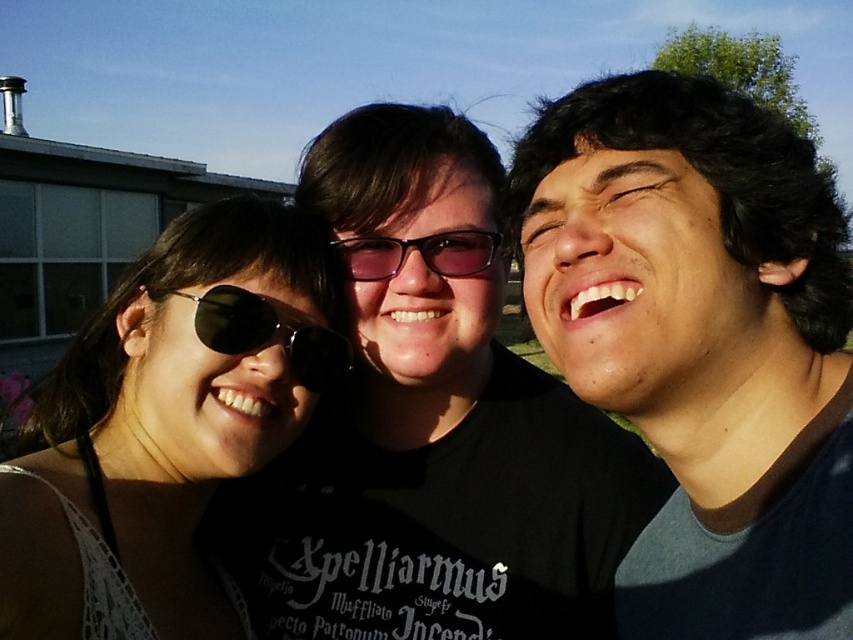
Is black reflective sunglasses at center closer to camera compared to purple reflective glasses at center?

Yes, black reflective sunglasses at center is in front of purple reflective glasses at center.

What do you see at coordinates (267, 332) in the screenshot? I see `black reflective sunglasses at center` at bounding box center [267, 332].

Identify the location of black reflective sunglasses at center. (267, 332).

Which is in front, point (155, 336) or point (207, 307)?

Point (207, 307) is more forward.

Does point (16, 518) come in front of point (250, 292)?

Yes, it is in front of point (250, 292).

Identify the location of sunglasses at left. (165, 426).

Is dark brown hair at upper right bigger than sunglasses at left?

Actually, dark brown hair at upper right might be smaller than sunglasses at left.

Is dark brown hair at upper right positioned in front of sunglasses at left?

Yes, dark brown hair at upper right is closer to the viewer.

Is point (804, 442) more distant than point (194, 365)?

No.

Identify the location of dark brown hair at upper right. Image resolution: width=853 pixels, height=640 pixels. (701, 342).